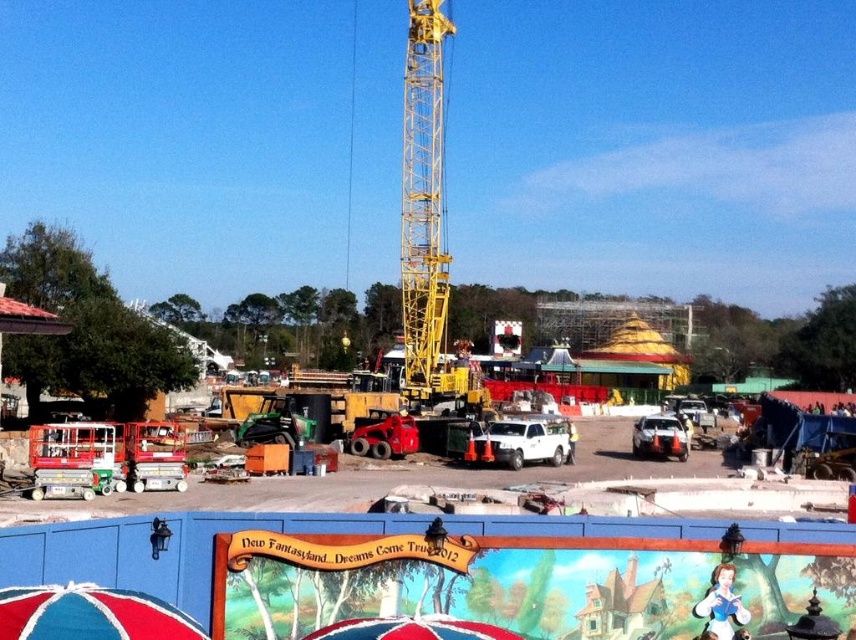
Does yellow metallic crane at center have a larger size compared to white matte truck at center?

Indeed, yellow metallic crane at center has a larger size compared to white matte truck at center.

Does yellow metallic crane at center appear under white matte truck at center?

No, yellow metallic crane at center is not below white matte truck at center.

Measure the distance between yellow metallic crane at center and camera.

yellow metallic crane at center is 65.04 meters away from camera.

Find the location of a particular element. yellow metallic crane at center is located at coordinates (424, 211).

Between red fabric umbrella at lower left and white matte truck at center, which one appears on the left side from the viewer's perspective?

Positioned to the left is red fabric umbrella at lower left.

Can you confirm if red fabric umbrella at lower left is wider than white matte truck at center?

No, red fabric umbrella at lower left is not wider than white matte truck at center.

Between point (96, 632) and point (491, 460), which one is positioned in front?

Point (96, 632)

Identify the location of red fabric umbrella at lower left. (90, 614).

Can you confirm if white matte truck at center is positioned below red fabric umbrella at lower center?

Indeed, white matte truck at center is positioned under red fabric umbrella at lower center.

Is point (556, 454) positioned behind point (483, 627)?

Yes, point (556, 454) is behind point (483, 627).

Who is more forward, (x=512, y=465) or (x=343, y=637)?

Positioned in front is point (x=343, y=637).

Where is `white matte truck at center`? white matte truck at center is located at coordinates (521, 442).